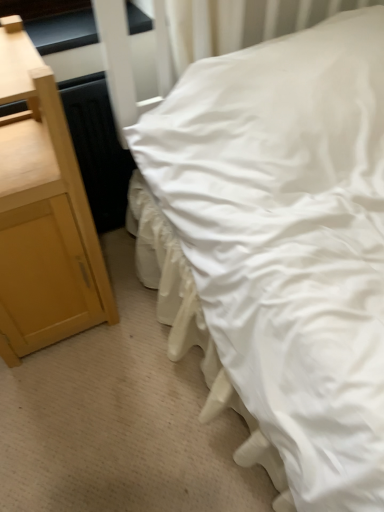
Question: Is light wood/texture nightstand at left far from white smooth bed at center?

Choices:
 (A) no
 (B) yes

Answer: (A)

Question: Is light wood/texture nightstand at left oriented away from white smooth bed at center?

Choices:
 (A) no
 (B) yes

Answer: (A)

Question: Considering the relative positions of light wood/texture nightstand at left and white smooth bed at center in the image provided, is light wood/texture nightstand at left to the right of white smooth bed at center from the viewer's perspective?

Choices:
 (A) no
 (B) yes

Answer: (A)

Question: Is light wood/texture nightstand at left closer to camera compared to white smooth bed at center?

Choices:
 (A) no
 (B) yes

Answer: (A)

Question: From the image's perspective, would you say light wood/texture nightstand at left is positioned over white smooth bed at center?

Choices:
 (A) yes
 (B) no

Answer: (B)

Question: Considering the relative sizes of light wood/texture nightstand at left and white smooth bed at center in the image provided, is light wood/texture nightstand at left bigger than white smooth bed at center?

Choices:
 (A) no
 (B) yes

Answer: (A)

Question: From the image's perspective, is black glossy window sill at upper left below light wood/texture nightstand at left?

Choices:
 (A) no
 (B) yes

Answer: (A)

Question: Is black glossy window sill at upper left bigger than light wood/texture nightstand at left?

Choices:
 (A) yes
 (B) no

Answer: (B)

Question: Is black glossy window sill at upper left outside of light wood/texture nightstand at left?

Choices:
 (A) no
 (B) yes

Answer: (B)

Question: Considering the relative sizes of black glossy window sill at upper left and light wood/texture nightstand at left in the image provided, is black glossy window sill at upper left wider than light wood/texture nightstand at left?

Choices:
 (A) yes
 (B) no

Answer: (B)

Question: Can you confirm if black glossy window sill at upper left is taller than light wood/texture nightstand at left?

Choices:
 (A) no
 (B) yes

Answer: (A)

Question: Does black glossy window sill at upper left come in front of light wood/texture nightstand at left?

Choices:
 (A) no
 (B) yes

Answer: (A)

Question: Can you confirm if white smooth bed at center is smaller than light wood/texture nightstand at left?

Choices:
 (A) yes
 (B) no

Answer: (B)